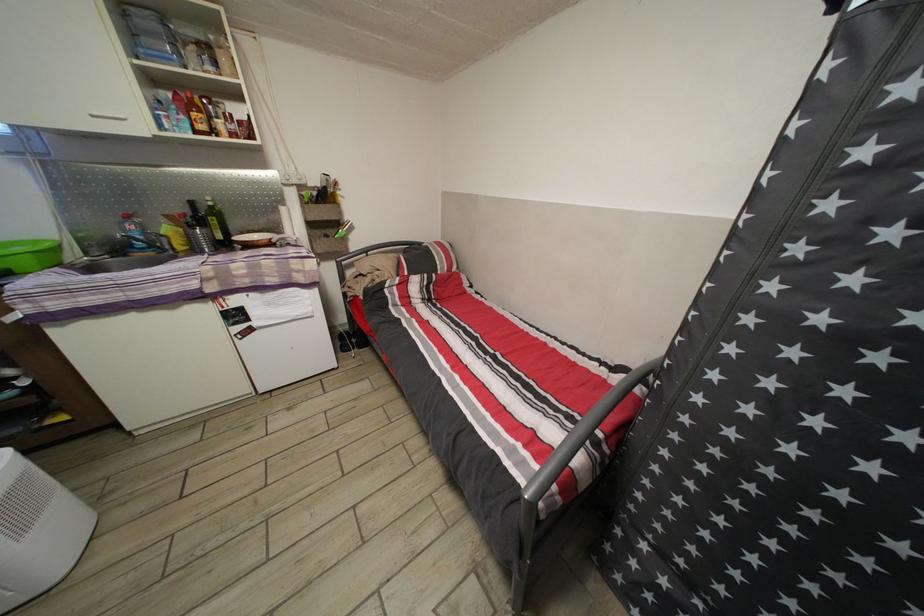
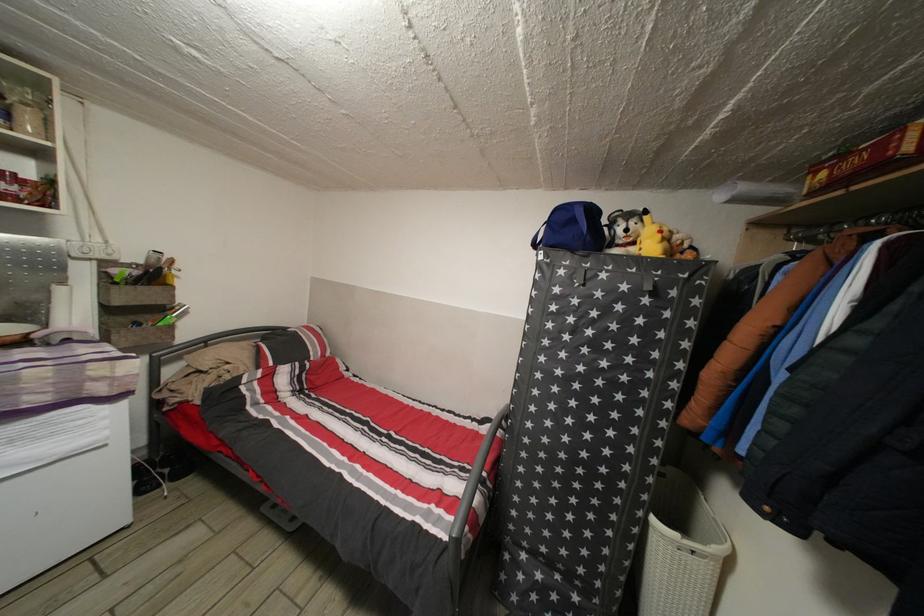
Question: The camera is either moving clockwise (left) or counter-clockwise (right) around the object. The first image is from the beginning of the video and the second image is from the end. Is the camera moving left or right when shooting the video?

Choices:
 (A) Left
 (B) Right

Answer: (A)